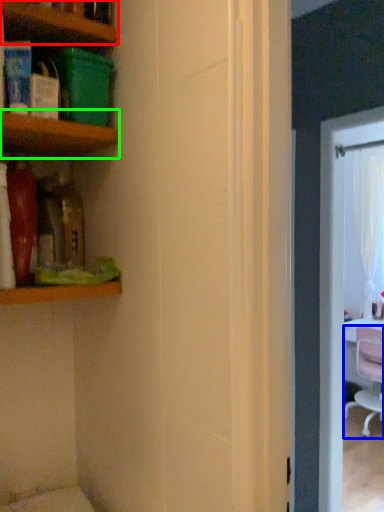
Question: Estimate the real-world distances between objects in this image. Which object is farther from shelf (highlighted by a red box), chair (highlighted by a blue box) or shelf (highlighted by a green box)?

Choices:
 (A) chair
 (B) shelf

Answer: (A)